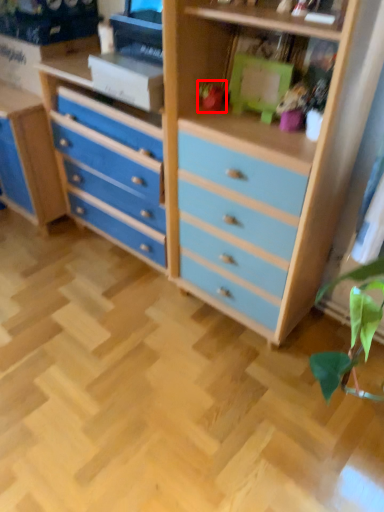
Question: Where is toy (annotated by the red box) located in relation to toy in the image?

Choices:
 (A) right
 (B) left

Answer: (B)